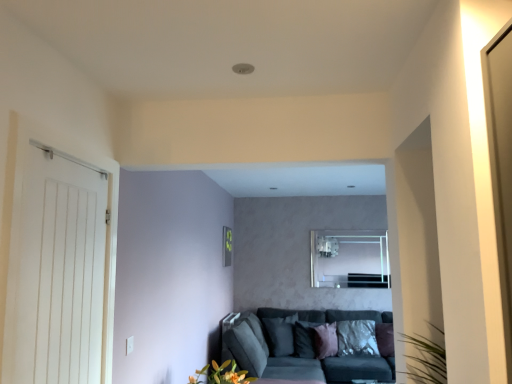
Question: Relative to silky purple pillow at center, acting as the fourth pillow starting from the right, is white wooden door at left in front or behind?

Choices:
 (A) behind
 (B) front

Answer: (B)

Question: From a real-world perspective, is white wooden door at left above or below silky purple pillow at center, arranged as the third pillow when viewed from the left?

Choices:
 (A) above
 (B) below

Answer: (A)

Question: Which object is the farthest from the velvet purple pillow at center, the 5th pillow positioned from the left?

Choices:
 (A) matte orange flowers at lower center
 (B) velvet dark grey couch at lower center
 (C) pink velvet pillow at center, arranged as the fourth pillow when viewed from the left
 (D) silky purple pillow at center, acting as the fourth pillow starting from the right
 (E) white wooden door at left

Answer: (E)

Question: Estimate the real-world distances between objects in this image. Which object is farther from the velvet purple pillow at center, which is the 2th pillow from right to left?

Choices:
 (A) clear glass mirror at upper center
 (B) pink velvet pillow at center, arranged as the fourth pillow when viewed from the left
 (C) matte orange flowers at lower center
 (D) purple velvet pillow at lower right, positioned as the 6th pillow in left-to-right order
 (E) silky purple pillow at center, the 5th pillow when ordered from right to left

Answer: (C)